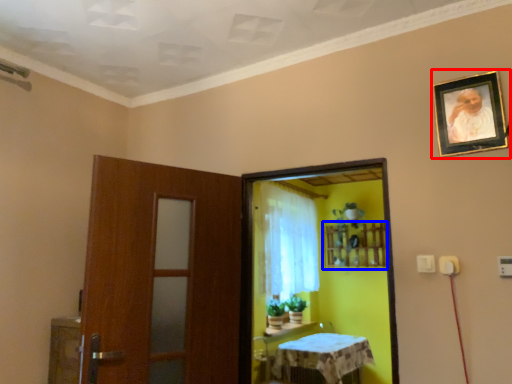
Question: Which object appears closest to the camera in this image, picture frame (highlighted by a red box) or shelf (highlighted by a blue box)?

Choices:
 (A) picture frame
 (B) shelf

Answer: (A)